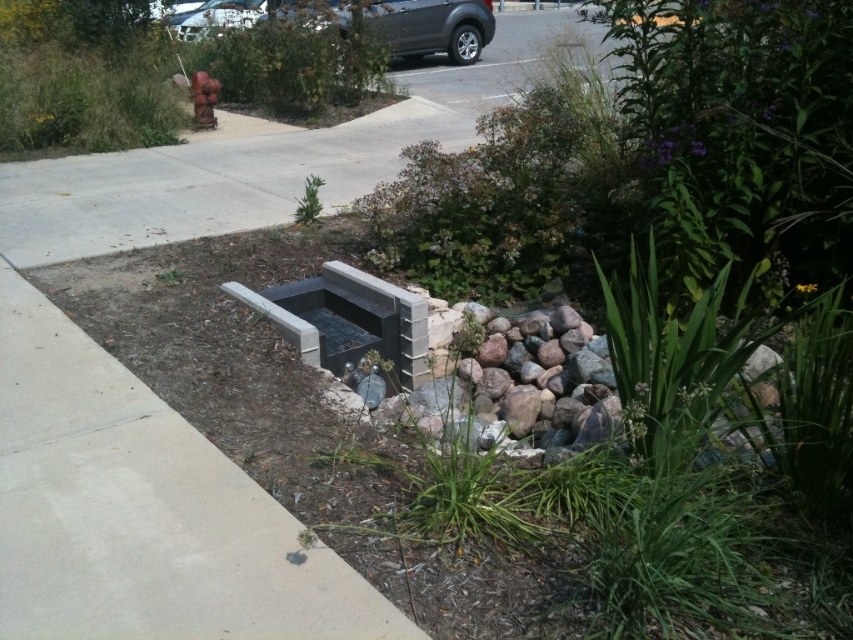
Is gray concrete bench at lower center to the left of concrete at center from the viewer's perspective?

Correct, you'll find gray concrete bench at lower center to the left of concrete at center.

Does gray concrete bench at lower center have a greater height compared to concrete at center?

No.

Identify the location of gray concrete bench at lower center. (142, 509).

Is gray concrete bench at lower center to the right of metallic silver car at upper center from the viewer's perspective?

Correct, you'll find gray concrete bench at lower center to the right of metallic silver car at upper center.

Does gray concrete bench at lower center have a lesser width compared to metallic silver car at upper center?

In fact, gray concrete bench at lower center might be wider than metallic silver car at upper center.

Between point (102, 582) and point (190, 38), which one is positioned behind?

The point (190, 38) is behind.

In order to click on gray concrete bench at lower center in this screenshot , I will do `click(142, 509)`.

Is concrete at center closer to camera compared to metallic silver car at upper center?

Yes, concrete at center is closer to the viewer.

Is concrete at center shorter than metallic silver car at upper center?

Incorrect, concrete at center's height does not fall short of metallic silver car at upper center's.

Is point (415, 113) farther from viewer compared to point (190, 26)?

That is False.

You are a GUI agent. You are given a task and a screenshot of the screen. Output one action in this format:
    pyautogui.click(x=<x>, y=<y>)
    Task: Click on the concrete at center
    
    Given the screenshot: What is the action you would take?
    pyautogui.click(x=258, y=161)